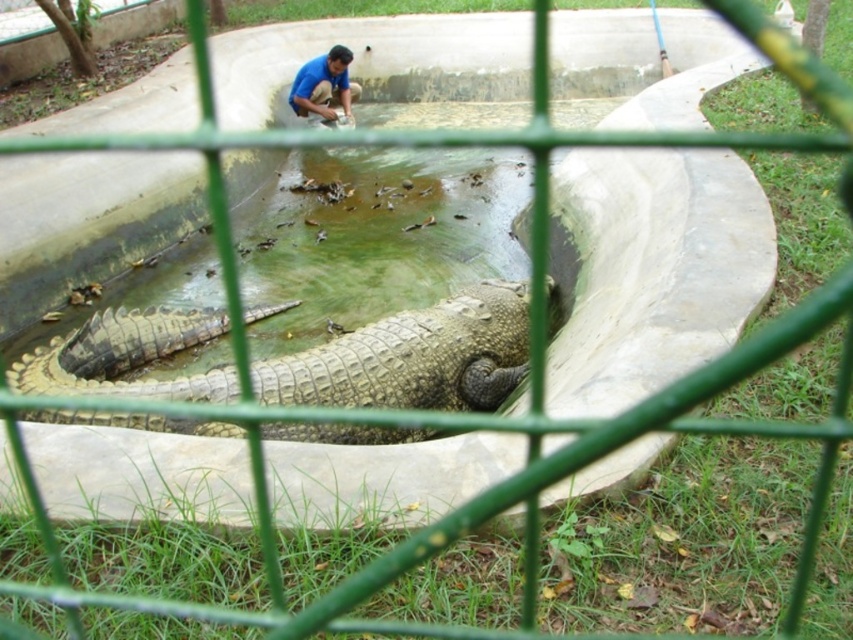
Question: Which object appears closest to the camera in this image?

Choices:
 (A) leathery brown crocodile at center
 (B) blue shirt at upper center

Answer: (A)

Question: Can you confirm if leathery brown crocodile at center is positioned above blue shirt at upper center?

Choices:
 (A) yes
 (B) no

Answer: (B)

Question: Can you confirm if leathery brown crocodile at center is positioned to the left of blue shirt at upper center?

Choices:
 (A) yes
 (B) no

Answer: (B)

Question: Which point is closer to the camera?

Choices:
 (A) blue shirt at upper center
 (B) leathery brown crocodile at center

Answer: (B)

Question: Can you confirm if leathery brown crocodile at center is bigger than blue shirt at upper center?

Choices:
 (A) no
 (B) yes

Answer: (B)